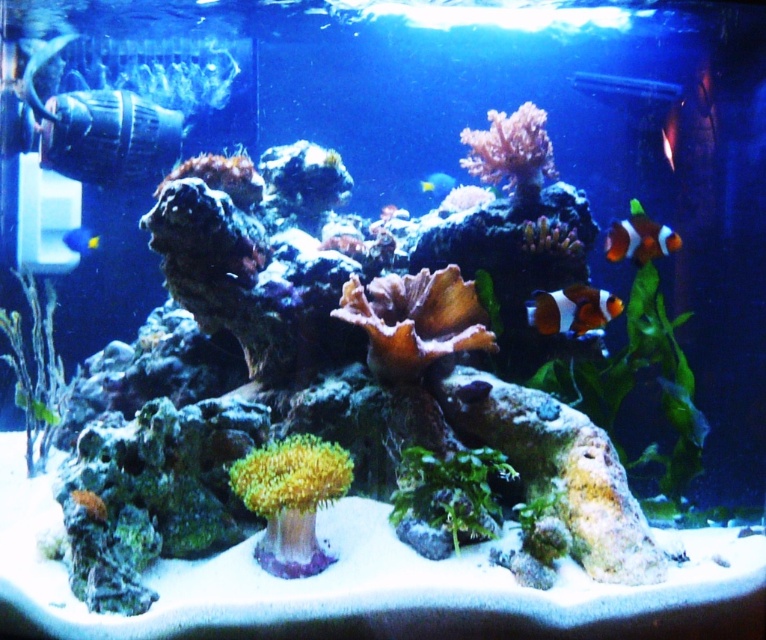
Question: Does orange and white striped fish at upper right have a larger size compared to orange clownfish at upper right?

Choices:
 (A) no
 (B) yes

Answer: (B)

Question: Estimate the real-world distances between objects in this image. Which object is closer to the translucent yellow fish at center?

Choices:
 (A) orange and white striped fish at upper right
 (B) blue glossy fish at left

Answer: (A)

Question: Among these objects, which one is nearest to the camera?

Choices:
 (A) black and white striped fish at center
 (B) orange coral at lower left
 (C) blue glossy fish at left
 (D) orange clownfish at upper right

Answer: (B)

Question: Does orange clownfish at upper right have a larger size compared to green matte coral at center?

Choices:
 (A) no
 (B) yes

Answer: (A)

Question: Among these points, which one is farthest from the camera?

Choices:
 (A) (656, 243)
 (B) (440, 186)
 (C) (633, 77)
 (D) (17, 381)

Answer: (B)

Question: Is black and white striped fish at center positioned in front of orange coral at lower left?

Choices:
 (A) no
 (B) yes

Answer: (A)